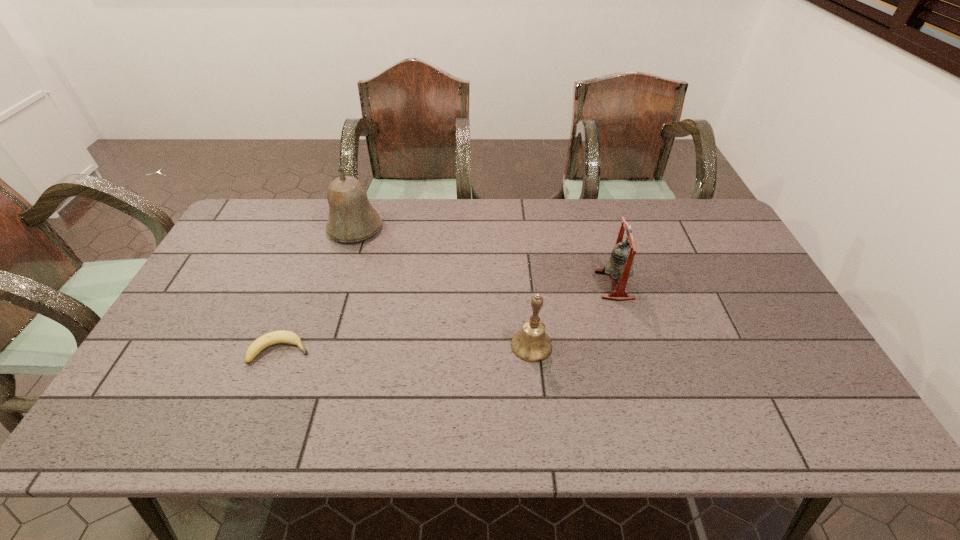
Identify the location of vacant region located 0.200m on the back of the banana. The image size is (960, 540). (307, 282).

This screenshot has width=960, height=540. I want to click on object that is at the far edge, so [x=352, y=218].

The width and height of the screenshot is (960, 540). In the image, there is a desktop. Find the location of `vacant space at the far edge`. vacant space at the far edge is located at coordinates (x=649, y=241).

Locate an element on the screen. This screenshot has width=960, height=540. vacant space at the near edge of the desktop is located at coordinates (612, 422).

Locate an element on the screen. The image size is (960, 540). free space at the left edge is located at coordinates (250, 286).

Locate an element on the screen. free space at the right edge is located at coordinates (786, 375).

At what (x,y) coordinates should I click in order to perform the action: click on vacant position at the far left corner of the desktop. Please return your answer as a coordinate pair (x, y). The image size is (960, 540). Looking at the image, I should click on (238, 235).

At what (x,y) coordinates should I click in order to perform the action: click on free space at the far right corner of the desktop. Please return your answer as a coordinate pair (x, y). The width and height of the screenshot is (960, 540). Looking at the image, I should click on (697, 206).

Find the location of a particular element. The height and width of the screenshot is (540, 960). free space between the rightmost object and the leftmost bell is located at coordinates (485, 256).

The image size is (960, 540). I want to click on free spot between the second bell from right to left and the leftmost bell, so click(x=444, y=286).